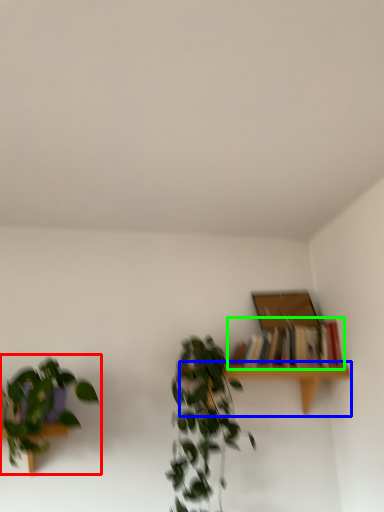
Question: Which object is positioned farthest from houseplant (highlighted by a red box)? Select from table (highlighted by a blue box) and book (highlighted by a green box).

Choices:
 (A) table
 (B) book

Answer: (B)